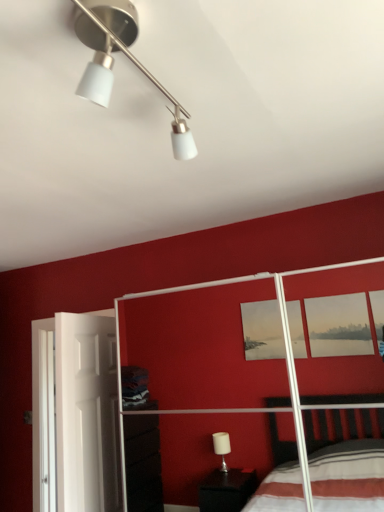
Locate an element on the screen. Image resolution: width=384 pixels, height=512 pixels. free space above white matte track light at upper center (from a real-world perspective) is located at coordinates (152, 59).